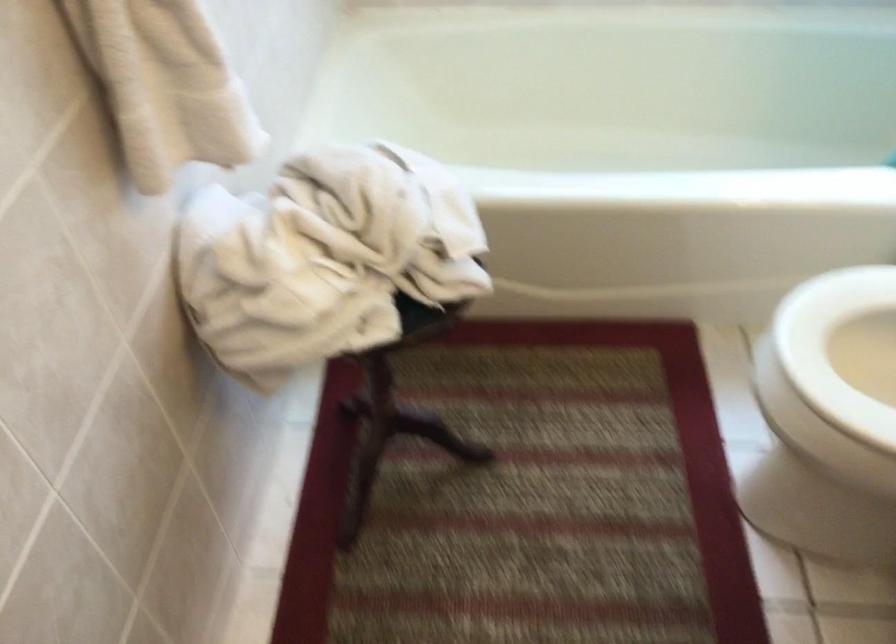
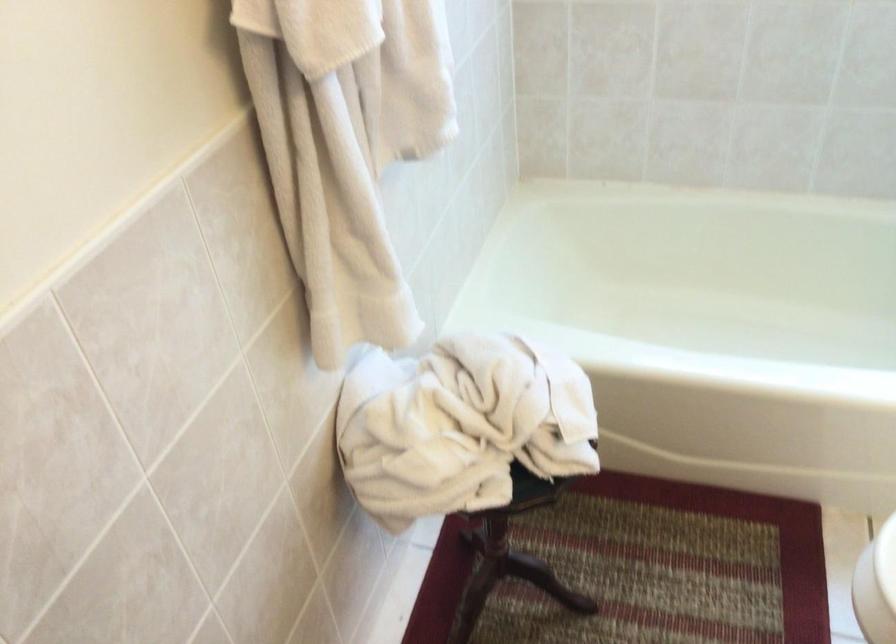
The point at (544, 122) is marked in the first image. Where is the corresponding point in the second image?

(698, 283)